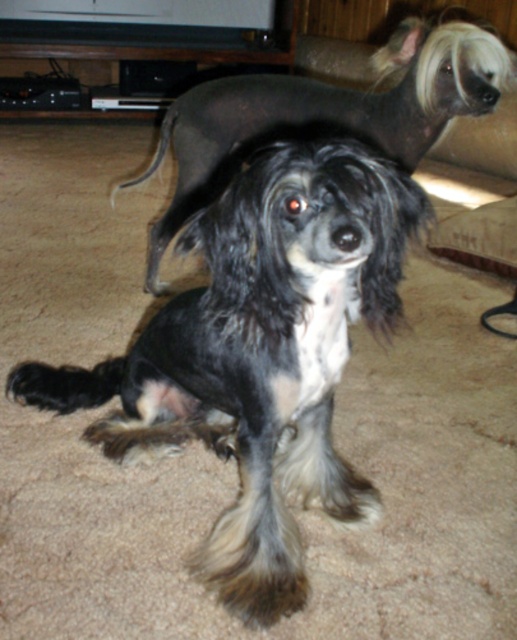
In the scene shown: You are a photographer setting up for a pet photoshoot. You have a camera focused on an object 38.39 inches away. You want to capture the black and white fur at center in focus. Is the camera currently focused on the correct subject?

The black and white fur at center is 38.39 inches from camera, so yes, the camera is focused on the correct subject since the focus distance matches the subject distance.

You are a dog trainer observing two Chinese Crested dogs in a room. You notice the black silky dog at center and the black fur tail at upper center. Which object is wider?

The black silky dog at center is wider than the black fur tail at upper center.

What are the coordinates of the black and white fur at center?

→ The coordinates of the black and white fur at center are at point (260, 353).